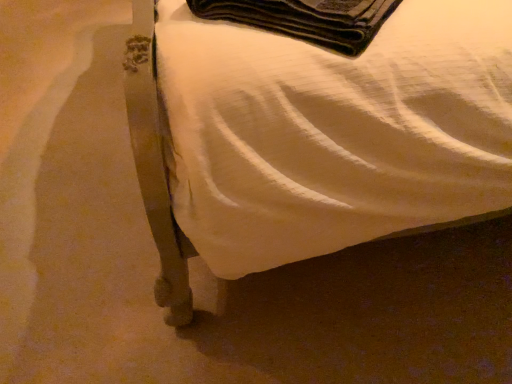
Question: Looking at their shapes, would you say metallic bed frame at lower left is wider or thinner than black felt wallet at upper center?

Choices:
 (A) wide
 (B) thin

Answer: (A)

Question: In terms of height, does metallic bed frame at lower left look taller or shorter compared to black felt wallet at upper center?

Choices:
 (A) short
 (B) tall

Answer: (B)

Question: Would you say metallic bed frame at lower left is to the left or to the right of black felt wallet at upper center in the picture?

Choices:
 (A) left
 (B) right

Answer: (B)

Question: Does point (340, 9) appear closer or farther from the camera than point (151, 140)?

Choices:
 (A) farther
 (B) closer

Answer: (A)

Question: From the image's perspective, relative to metallic bed frame at lower left, is black felt wallet at upper center above or below?

Choices:
 (A) below
 (B) above

Answer: (A)

Question: Considering the positions of black felt wallet at upper center and metallic bed frame at lower left in the image, is black felt wallet at upper center wider or thinner than metallic bed frame at lower left?

Choices:
 (A) wide
 (B) thin

Answer: (B)

Question: Is black felt wallet at upper center to the left or to the right of metallic bed frame at lower left in the image?

Choices:
 (A) right
 (B) left

Answer: (B)